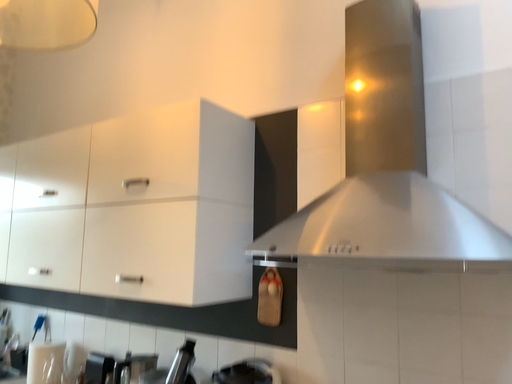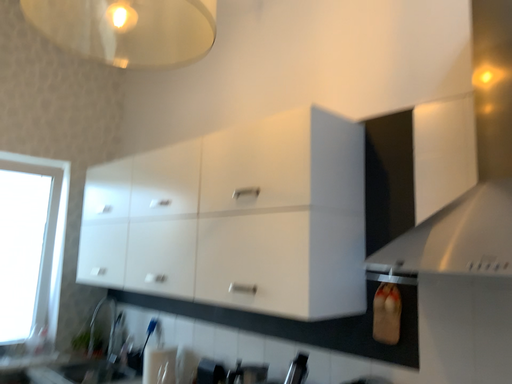
Question: Which way did the camera rotate in the video?

Choices:
 (A) rotated right
 (B) rotated left

Answer: (B)